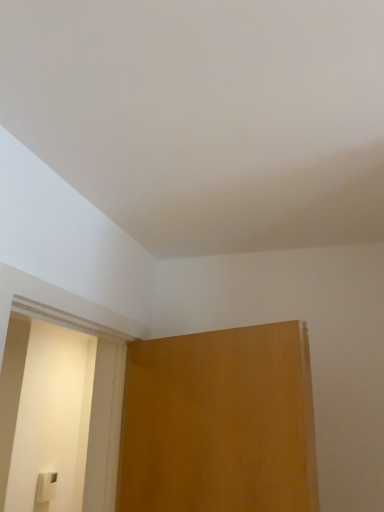
Question: From a real-world perspective, is white plastic light switch at lower left located higher than matte wood screen door at left?

Choices:
 (A) yes
 (B) no

Answer: (B)

Question: Is white plastic light switch at lower left surrounding matte wood screen door at left?

Choices:
 (A) no
 (B) yes

Answer: (A)

Question: Can you confirm if white plastic light switch at lower left is smaller than matte wood screen door at left?

Choices:
 (A) no
 (B) yes

Answer: (B)

Question: From the image's perspective, is white plastic light switch at lower left located beneath matte wood screen door at left?

Choices:
 (A) no
 (B) yes

Answer: (B)

Question: Does white plastic light switch at lower left have a lesser height compared to matte wood screen door at left?

Choices:
 (A) no
 (B) yes

Answer: (B)

Question: Is white plastic light switch at lower left located outside matte wood screen door at left?

Choices:
 (A) no
 (B) yes

Answer: (B)

Question: Is matte wood screen door at left closer to the viewer compared to white plastic light switch at lower left?

Choices:
 (A) no
 (B) yes

Answer: (B)

Question: From a real-world perspective, does matte wood screen door at left sit lower than white plastic light switch at lower left?

Choices:
 (A) no
 (B) yes

Answer: (A)

Question: Does matte wood screen door at left have a larger size compared to white plastic light switch at lower left?

Choices:
 (A) yes
 (B) no

Answer: (A)

Question: Can you confirm if matte wood screen door at left is thinner than white plastic light switch at lower left?

Choices:
 (A) no
 (B) yes

Answer: (A)

Question: Is matte wood screen door at left smaller than white plastic light switch at lower left?

Choices:
 (A) no
 (B) yes

Answer: (A)

Question: Is the surface of matte wood screen door at left in direct contact with white plastic light switch at lower left?

Choices:
 (A) no
 (B) yes

Answer: (A)

Question: From their relative heights in the image, would you say white plastic light switch at lower left is taller or shorter than matte wood screen door at left?

Choices:
 (A) tall
 (B) short

Answer: (B)